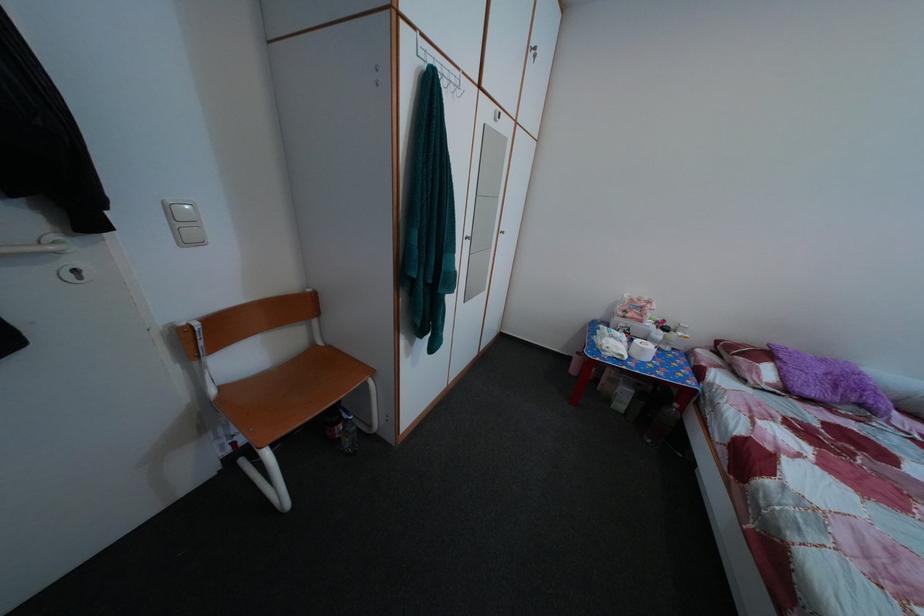
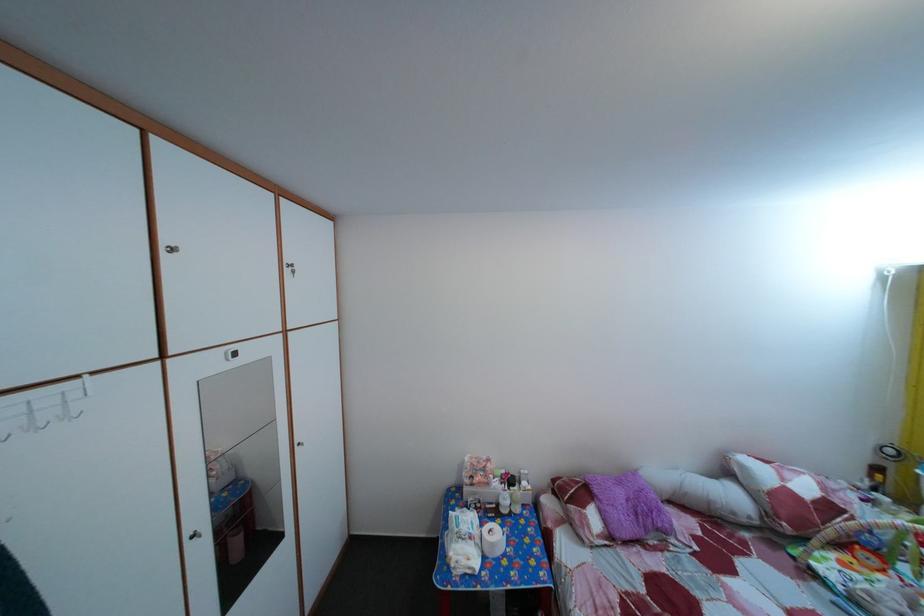
Locate, in the second image, the point that corresponds to pixel 652 358 in the first image.

(502, 553)